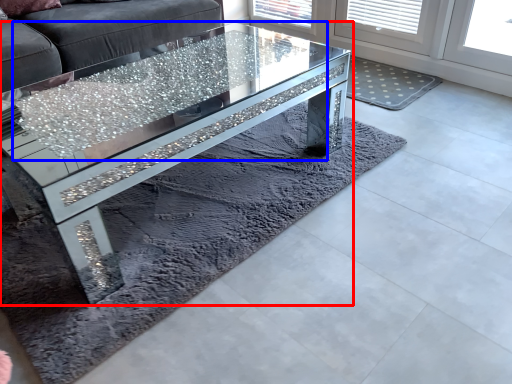
Question: Which point is closer to the camera, coffee table (highlighted by a red box) or glass table (highlighted by a blue box)?

Choices:
 (A) coffee table
 (B) glass table

Answer: (A)